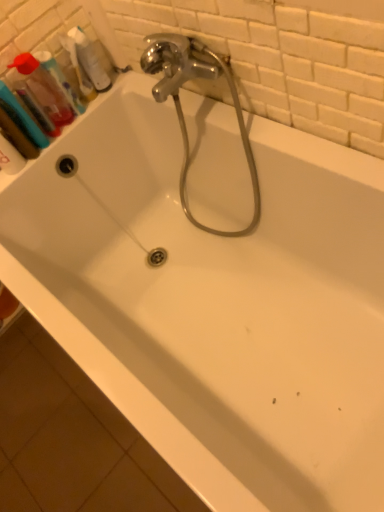
Where is `translucent plastic mouthwash at upper left, positioned as the 1th mouthwash in right-to-left order`? The image size is (384, 512). translucent plastic mouthwash at upper left, positioned as the 1th mouthwash in right-to-left order is located at coordinates (60, 79).

In order to face translucent plastic mouthwash at upper left, marked as the third mouthwash in a right-to-left arrangement, should I rotate leftwards or rightwards?

A 21.669 degree turn to the left will do.

Where is `translucent plastic bottle at upper left`? translucent plastic bottle at upper left is located at coordinates (88, 59).

Considering the positions of objects translucent plastic mouthwash at upper left, the second mouthwash from the right, and translucent plastic mouthwash at upper left, which ranks as the third mouthwash in left-to-right order, in the image provided, who is more to the right, translucent plastic mouthwash at upper left, the second mouthwash from the right, or translucent plastic mouthwash at upper left, which ranks as the third mouthwash in left-to-right order,?

translucent plastic mouthwash at upper left, which ranks as the third mouthwash in left-to-right order, is more to the right.

Is translucent plastic mouthwash at upper left, which is counted as the 2th mouthwash, starting from the left, not within translucent plastic mouthwash at upper left, which ranks as the third mouthwash in left-to-right order?

Yes, translucent plastic mouthwash at upper left, which is counted as the 2th mouthwash, starting from the left, is located beyond the bounds of translucent plastic mouthwash at upper left, which ranks as the third mouthwash in left-to-right order.

Is point (35, 83) farther from camera compared to point (41, 61)?

No, (35, 83) is closer to viewer.

Is translucent plastic mouthwash at upper left, the second mouthwash from the right, next to translucent plastic mouthwash at upper left, which ranks as the third mouthwash in left-to-right order, and touching it?

Absolutely, translucent plastic mouthwash at upper left, the second mouthwash from the right, is next to and touching translucent plastic mouthwash at upper left, which ranks as the third mouthwash in left-to-right order.

Is translucent plastic mouthwash at upper left, which ranks as the 1th mouthwash in left-to-right order, directly adjacent to translucent plastic mouthwash at upper left, the second mouthwash from the right?

Yes, translucent plastic mouthwash at upper left, which ranks as the 1th mouthwash in left-to-right order, is next to translucent plastic mouthwash at upper left, the second mouthwash from the right.

Is translucent plastic mouthwash at upper left, which ranks as the 1th mouthwash in left-to-right order, outside of translucent plastic mouthwash at upper left, which is counted as the 2th mouthwash, starting from the left?

Yes, translucent plastic mouthwash at upper left, which ranks as the 1th mouthwash in left-to-right order, is located beyond the bounds of translucent plastic mouthwash at upper left, which is counted as the 2th mouthwash, starting from the left.

Considering the relative sizes of translucent plastic mouthwash at upper left, marked as the third mouthwash in a right-to-left arrangement, and translucent plastic mouthwash at upper left, which is counted as the 2th mouthwash, starting from the left, in the image provided, is translucent plastic mouthwash at upper left, marked as the third mouthwash in a right-to-left arrangement, bigger than translucent plastic mouthwash at upper left, which is counted as the 2th mouthwash, starting from the left,?

Incorrect, translucent plastic mouthwash at upper left, marked as the third mouthwash in a right-to-left arrangement, is not larger than translucent plastic mouthwash at upper left, which is counted as the 2th mouthwash, starting from the left.

Considering the relative sizes of translucent plastic mouthwash at upper left, which ranks as the 1th mouthwash in left-to-right order, and translucent plastic mouthwash at upper left, the second mouthwash from the right, in the image provided, is translucent plastic mouthwash at upper left, which ranks as the 1th mouthwash in left-to-right order, wider than translucent plastic mouthwash at upper left, the second mouthwash from the right,?

Correct, the width of translucent plastic mouthwash at upper left, which ranks as the 1th mouthwash in left-to-right order, exceeds that of translucent plastic mouthwash at upper left, the second mouthwash from the right.

Is translucent plastic mouthwash at upper left, which ranks as the third mouthwash in left-to-right order, taller or shorter than translucent plastic bottle at upper left?

In the image, translucent plastic mouthwash at upper left, which ranks as the third mouthwash in left-to-right order, appears to be taller than translucent plastic bottle at upper left.

Could you tell me if translucent plastic mouthwash at upper left, which ranks as the third mouthwash in left-to-right order, is turned towards translucent plastic bottle at upper left?

No, translucent plastic mouthwash at upper left, which ranks as the third mouthwash in left-to-right order, is not aimed at translucent plastic bottle at upper left.

Is translucent plastic mouthwash at upper left, positioned as the 1th mouthwash in right-to-left order, inside the boundaries of translucent plastic bottle at upper left, or outside?

The correct answer is: outside.

Considering the positions of objects translucent plastic mouthwash at upper left, the second mouthwash from the right, and translucent plastic bottle at upper left in the image provided, who is behind, translucent plastic mouthwash at upper left, the second mouthwash from the right, or translucent plastic bottle at upper left?

translucent plastic bottle at upper left is further from the camera.

Is translucent plastic mouthwash at upper left, which is counted as the 2th mouthwash, starting from the left, taller than translucent plastic bottle at upper left?

Correct, translucent plastic mouthwash at upper left, which is counted as the 2th mouthwash, starting from the left, is much taller as translucent plastic bottle at upper left.

In the scene shown: How different are the orientations of translucent plastic mouthwash at upper left, which is counted as the 2th mouthwash, starting from the left, and translucent plastic mouthwash at upper left, marked as the third mouthwash in a right-to-left arrangement, in degrees?

0.000548 degrees separate the facing orientations of translucent plastic mouthwash at upper left, which is counted as the 2th mouthwash, starting from the left, and translucent plastic mouthwash at upper left, marked as the third mouthwash in a right-to-left arrangement.

Looking at this image, from the image's perspective, between translucent plastic mouthwash at upper left, the second mouthwash from the right, and translucent plastic mouthwash at upper left, marked as the third mouthwash in a right-to-left arrangement, who is located below?

From the image's view, translucent plastic mouthwash at upper left, marked as the third mouthwash in a right-to-left arrangement, is below.

Is translucent plastic mouthwash at upper left, the second mouthwash from the right, surrounding translucent plastic mouthwash at upper left, which ranks as the 1th mouthwash in left-to-right order?

That's incorrect, translucent plastic mouthwash at upper left, which ranks as the 1th mouthwash in left-to-right order, is not inside translucent plastic mouthwash at upper left, the second mouthwash from the right.

Between translucent plastic mouthwash at upper left, the second mouthwash from the right, and translucent plastic mouthwash at upper left, which ranks as the 1th mouthwash in left-to-right order, which one has smaller width?

With smaller width is translucent plastic mouthwash at upper left, the second mouthwash from the right.

From their relative heights in the image, would you say translucent plastic bottle at upper left is taller or shorter than translucent plastic mouthwash at upper left, which ranks as the third mouthwash in left-to-right order?

Clearly, translucent plastic bottle at upper left is shorter compared to translucent plastic mouthwash at upper left, which ranks as the third mouthwash in left-to-right order.

Is translucent plastic bottle at upper left outside of translucent plastic mouthwash at upper left, which ranks as the third mouthwash in left-to-right order?

Yes, translucent plastic bottle at upper left is outside of translucent plastic mouthwash at upper left, which ranks as the third mouthwash in left-to-right order.

From a real-world perspective, does translucent plastic bottle at upper left stand above translucent plastic mouthwash at upper left, which ranks as the third mouthwash in left-to-right order?

No, from a real-world perspective, translucent plastic bottle at upper left is not above translucent plastic mouthwash at upper left, which ranks as the third mouthwash in left-to-right order.

Can you confirm if translucent plastic bottle at upper left is smaller than translucent plastic mouthwash at upper left, which ranks as the third mouthwash in left-to-right order?

No, translucent plastic bottle at upper left is not smaller than translucent plastic mouthwash at upper left, which ranks as the third mouthwash in left-to-right order.

Who is more distant, translucent plastic bottle at upper left or translucent plastic mouthwash at upper left, which ranks as the 1th mouthwash in left-to-right order?

translucent plastic bottle at upper left is further from the camera.

Can you confirm if translucent plastic bottle at upper left is taller than translucent plastic mouthwash at upper left, marked as the third mouthwash in a right-to-left arrangement?

No.

Is translucent plastic bottle at upper left wider or thinner than translucent plastic mouthwash at upper left, marked as the third mouthwash in a right-to-left arrangement?

Clearly, translucent plastic bottle at upper left has less width compared to translucent plastic mouthwash at upper left, marked as the third mouthwash in a right-to-left arrangement.

Considering the relative positions of translucent plastic bottle at upper left and translucent plastic mouthwash at upper left, marked as the third mouthwash in a right-to-left arrangement, in the image provided, is translucent plastic bottle at upper left to the right of translucent plastic mouthwash at upper left, marked as the third mouthwash in a right-to-left arrangement, from the viewer's perspective?

Indeed, translucent plastic bottle at upper left is positioned on the right side of translucent plastic mouthwash at upper left, marked as the third mouthwash in a right-to-left arrangement.

Where is `the 2nd mouthwash directly above the translucent plastic mouthwash at upper left, which ranks as the third mouthwash in left-to-right order (from a real-world perspective)`? Image resolution: width=384 pixels, height=512 pixels. the 2nd mouthwash directly above the translucent plastic mouthwash at upper left, which ranks as the third mouthwash in left-to-right order (from a real-world perspective) is located at coordinates pos(44,93).

This screenshot has height=512, width=384. In order to click on the 1st mouthwash counting from the right side of the translucent plastic mouthwash at upper left, which ranks as the 1th mouthwash in left-to-right order in this screenshot , I will do `click(44, 93)`.

Considering their positions, is translucent plastic bottle at upper left positioned further to translucent plastic mouthwash at upper left, which is counted as the 2th mouthwash, starting from the left, than translucent plastic mouthwash at upper left, marked as the third mouthwash in a right-to-left arrangement?

translucent plastic bottle at upper left is further to translucent plastic mouthwash at upper left, which is counted as the 2th mouthwash, starting from the left.

Based on their spatial positions, is translucent plastic mouthwash at upper left, positioned as the 1th mouthwash in right-to-left order, or translucent plastic mouthwash at upper left, which is counted as the 2th mouthwash, starting from the left, closer to translucent plastic mouthwash at upper left, marked as the third mouthwash in a right-to-left arrangement?

Among the two, translucent plastic mouthwash at upper left, which is counted as the 2th mouthwash, starting from the left, is located nearer to translucent plastic mouthwash at upper left, marked as the third mouthwash in a right-to-left arrangement.

Considering their positions, is translucent plastic mouthwash at upper left, marked as the third mouthwash in a right-to-left arrangement, positioned closer to translucent plastic bottle at upper left than translucent plastic mouthwash at upper left, the second mouthwash from the right?

translucent plastic mouthwash at upper left, the second mouthwash from the right, lies closer to translucent plastic bottle at upper left than the other object.

When comparing their distances from translucent plastic mouthwash at upper left, positioned as the 1th mouthwash in right-to-left order, does translucent plastic mouthwash at upper left, marked as the third mouthwash in a right-to-left arrangement, or translucent plastic bottle at upper left seem closer?

The object closer to translucent plastic mouthwash at upper left, positioned as the 1th mouthwash in right-to-left order, is translucent plastic bottle at upper left.

Looking at the image, which one is located closer to translucent plastic bottle at upper left, translucent plastic mouthwash at upper left, the second mouthwash from the right, or translucent plastic mouthwash at upper left, positioned as the 1th mouthwash in right-to-left order?

Based on the image, translucent plastic mouthwash at upper left, positioned as the 1th mouthwash in right-to-left order, appears to be nearer to translucent plastic bottle at upper left.

Based on their spatial positions, is translucent plastic mouthwash at upper left, which is counted as the 2th mouthwash, starting from the left, or translucent plastic mouthwash at upper left, which ranks as the 1th mouthwash in left-to-right order, closer to translucent plastic bottle at upper left?

The object closer to translucent plastic bottle at upper left is translucent plastic mouthwash at upper left, which is counted as the 2th mouthwash, starting from the left.

Looking at the image, which one is located closer to translucent plastic mouthwash at upper left, marked as the third mouthwash in a right-to-left arrangement, translucent plastic bottle at upper left or translucent plastic mouthwash at upper left, the second mouthwash from the right?

translucent plastic mouthwash at upper left, the second mouthwash from the right.

Looking at the image, which one is located further to translucent plastic mouthwash at upper left, which ranks as the 1th mouthwash in left-to-right order, translucent plastic mouthwash at upper left, which is counted as the 2th mouthwash, starting from the left, or translucent plastic bottle at upper left?

translucent plastic bottle at upper left is positioned further to the anchor translucent plastic mouthwash at upper left, which ranks as the 1th mouthwash in left-to-right order.

Identify the location of mouthwash situated between translucent plastic mouthwash at upper left, which is counted as the 2th mouthwash, starting from the left, and translucent plastic bottle at upper left from left to right. This screenshot has width=384, height=512. (60, 79).

At what (x,y) coordinates should I click in order to perform the action: click on mouthwash between translucent plastic mouthwash at upper left, positioned as the 1th mouthwash in right-to-left order, and translucent plastic mouthwash at upper left, marked as the third mouthwash in a right-to-left arrangement, in the vertical direction. Please return your answer as a coordinate pair (x, y). Looking at the image, I should click on (44, 93).